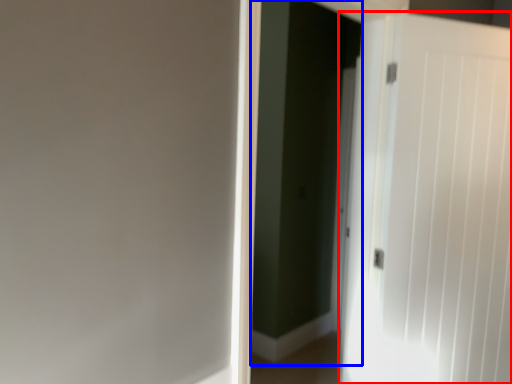
Question: Which object is further to the camera taking this photo, door (highlighted by a red box) or screen door (highlighted by a blue box)?

Choices:
 (A) door
 (B) screen door

Answer: (A)